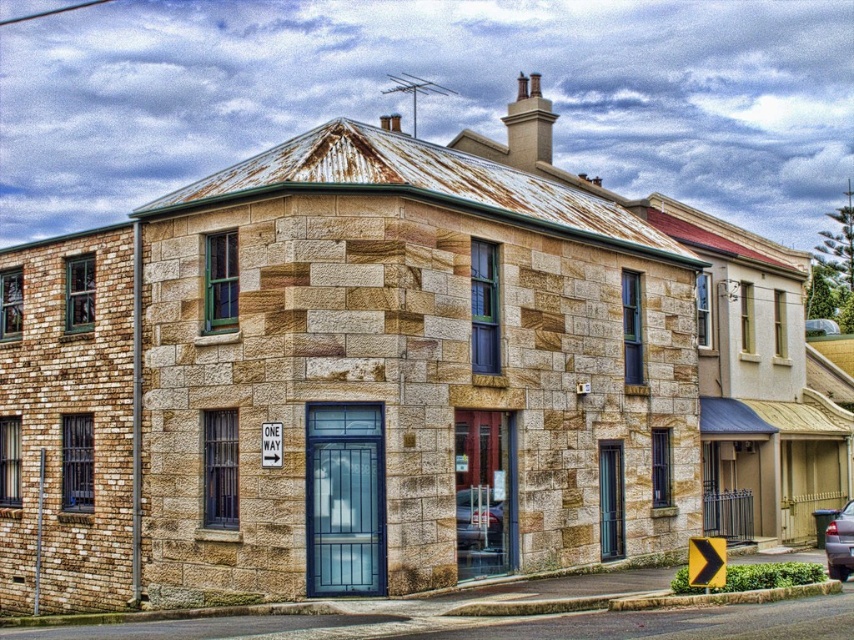
Can you confirm if metallic silver car at center is smaller than metallic silver sedan at lower right?

Yes, metallic silver car at center is smaller than metallic silver sedan at lower right.

Can you confirm if metallic silver car at center is shorter than metallic silver sedan at lower right?

Yes, metallic silver car at center is shorter than metallic silver sedan at lower right.

Is point (461, 502) positioned after point (841, 515)?

No, (461, 502) is in front of (841, 515).

Find the location of a particular element. metallic silver car at center is located at coordinates (478, 518).